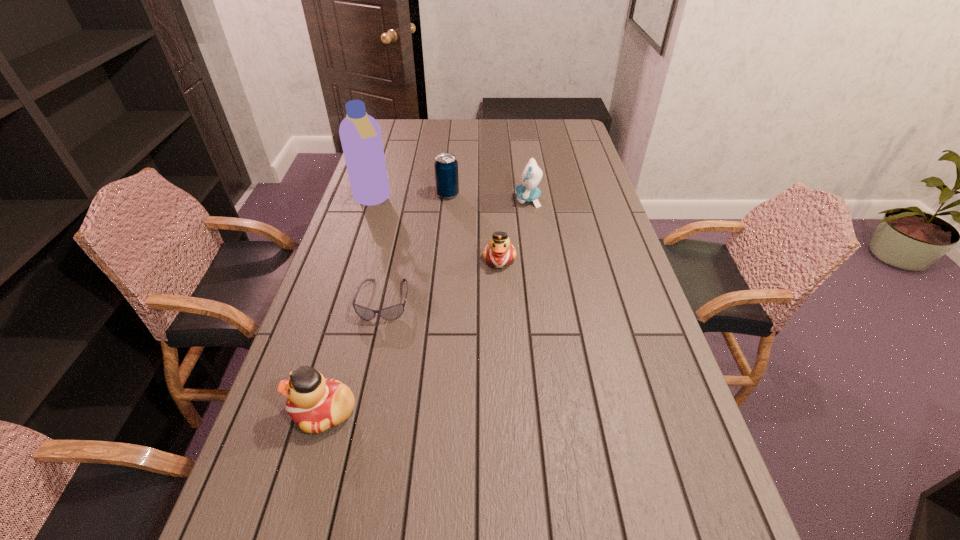
In order to click on empty space that is in between the rightmost object and the shampoo in this screenshot , I will do `click(450, 200)`.

Find the location of a particular element. This screenshot has width=960, height=540. free space between the fifth farthest object and the nearer duck is located at coordinates (354, 356).

Locate an element on the screen. Image resolution: width=960 pixels, height=540 pixels. vacant point located between the shortest object and the nearest object is located at coordinates 354,356.

Where is `free area in between the sunglasses and the farther duck`? free area in between the sunglasses and the farther duck is located at coordinates (442, 280).

In order to click on vacant point located between the right duck and the third object from right to left in this screenshot , I will do `click(473, 227)`.

Find the location of a particular element. object that ranks as the fifth closest to the kitten is located at coordinates (316, 404).

Select which object is the closest to the fifth object from left to right. Please provide its 2D coordinates. Your answer should be formatted as a tuple, i.e. [(x, y)], where the tuple contains the x and y coordinates of a point satisfying the conditions above.

[(393, 312)]